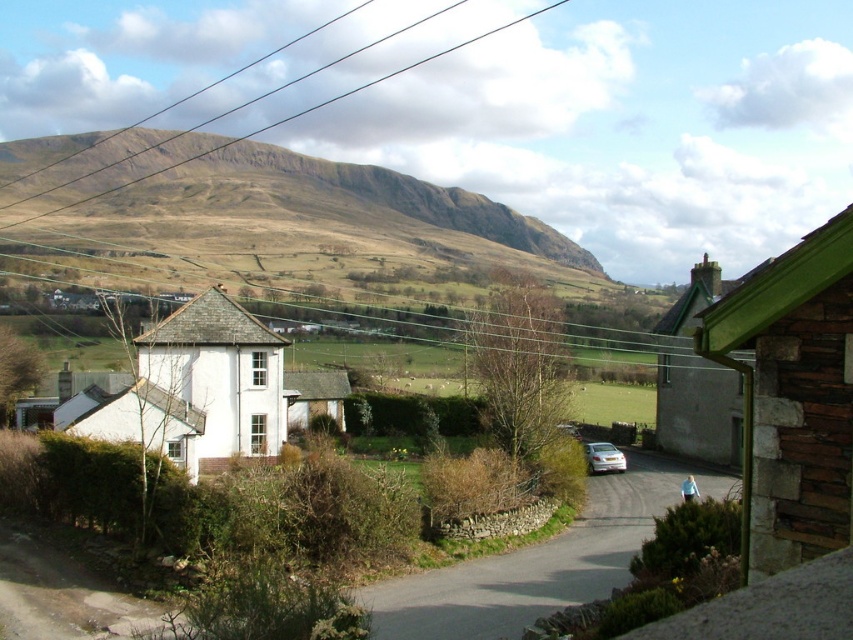
You are driving a silver metallic car at center and want to park it near the green wooden cottage at upper right. Based on the scene, is the cottage located to the right or left side of your current position?

The green wooden cottage at upper right is positioned on the right side of the silver metallic car at center, so the cottage is to your right.

You are a delivery driver approaching the smooth wire at upper center and the silver metallic car at center. Which object is closer to you as you drive along the road?

The smooth wire at upper center is closer to you because the silver metallic car at center is behind it.